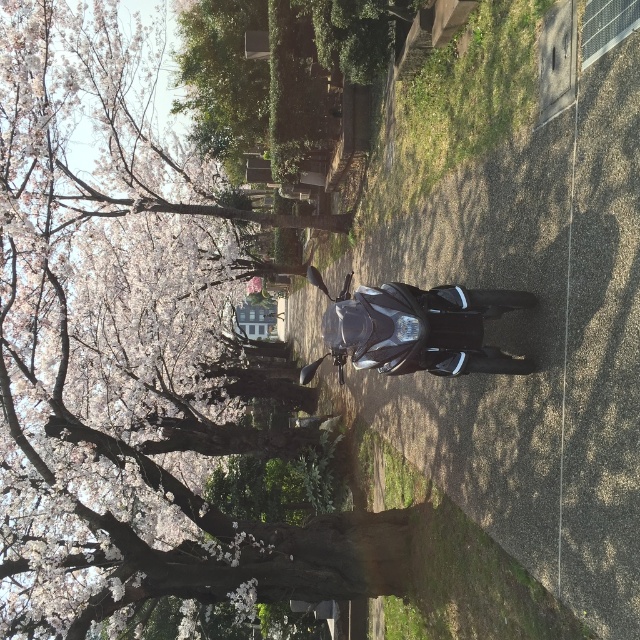
Question: Can you confirm if smooth bark tree at center is positioned below glossy black motorcycle at center?

Choices:
 (A) no
 (B) yes

Answer: (A)

Question: Considering the relative positions of smooth bark tree at center and glossy black motorcycle at center in the image provided, where is smooth bark tree at center located with respect to glossy black motorcycle at center?

Choices:
 (A) left
 (B) right

Answer: (A)

Question: Among these objects, which one is farthest from the camera?

Choices:
 (A) smooth bark tree at center
 (B) glossy black motorcycle at center

Answer: (A)

Question: Which point is closer to the camera?

Choices:
 (A) (184, 436)
 (B) (340, 332)

Answer: (B)

Question: Can you confirm if smooth bark tree at center is positioned above glossy black motorcycle at center?

Choices:
 (A) yes
 (B) no

Answer: (A)